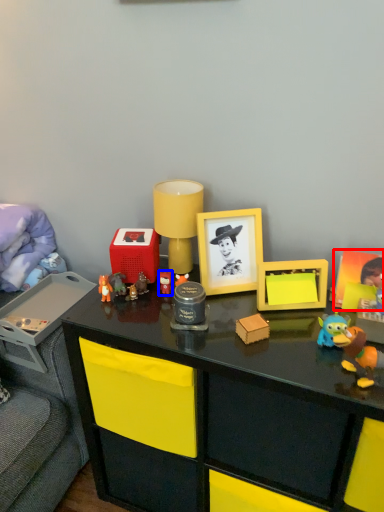
Question: Among these objects, which one is farthest to the camera, picture frame (highlighted by a red box) or toy (highlighted by a blue box)?

Choices:
 (A) picture frame
 (B) toy

Answer: (B)